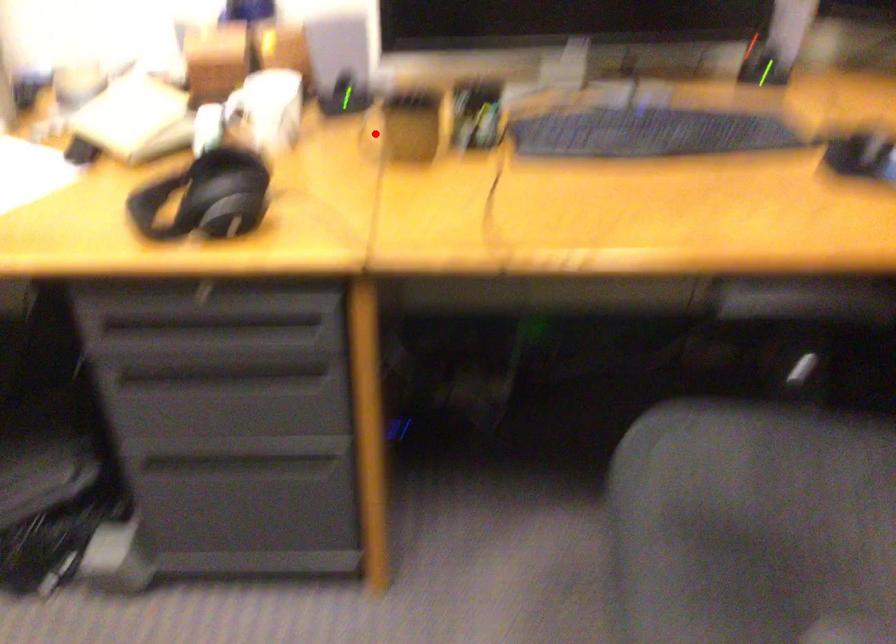
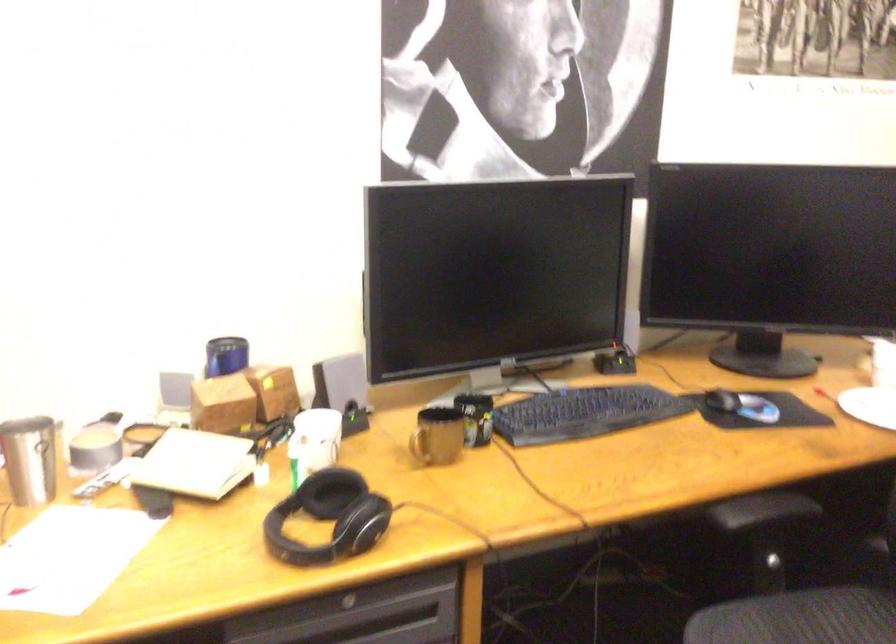
Where in the second image is the point corresponding to the highlighted location from the first image?

(419, 442)